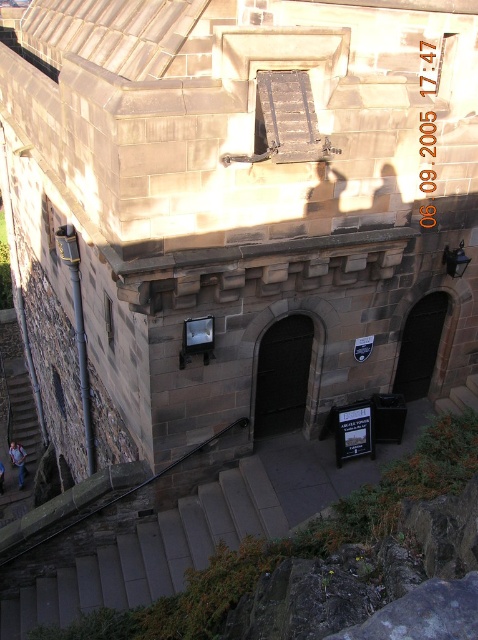
Question: Can you confirm if smooth stone stairs at lower center is smaller than blue jeans at bottom left?

Choices:
 (A) yes
 (B) no

Answer: (B)

Question: Among these points, which one is nearest to the camera?

Choices:
 (A) click(x=10, y=454)
 (B) click(x=177, y=548)
 (C) click(x=40, y=433)

Answer: (B)

Question: Can you confirm if dark stone door at center is thinner than wooden staircase at lower left?

Choices:
 (A) no
 (B) yes

Answer: (A)

Question: Considering the real-world distances, which object is farthest from the dark stone door at center?

Choices:
 (A) wooden staircase at lower left
 (B) blue jeans at bottom left

Answer: (A)

Question: Which object appears farthest from the camera in this image?

Choices:
 (A) blue jeans at bottom left
 (B) wooden staircase at lower left
 (C) black stone door at center

Answer: (B)

Question: Can you confirm if wooden staircase at lower left is positioned to the right of black stone door at center?

Choices:
 (A) yes
 (B) no

Answer: (B)